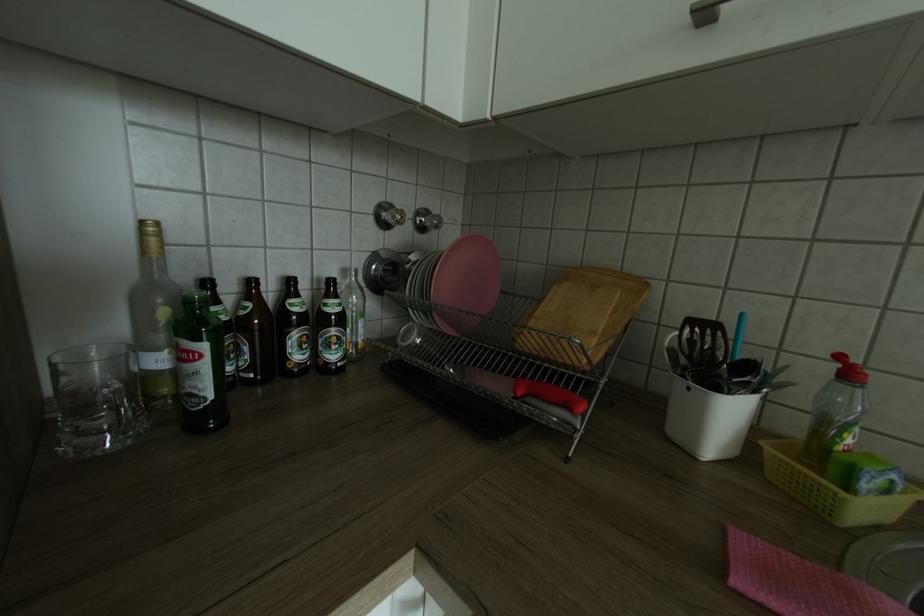
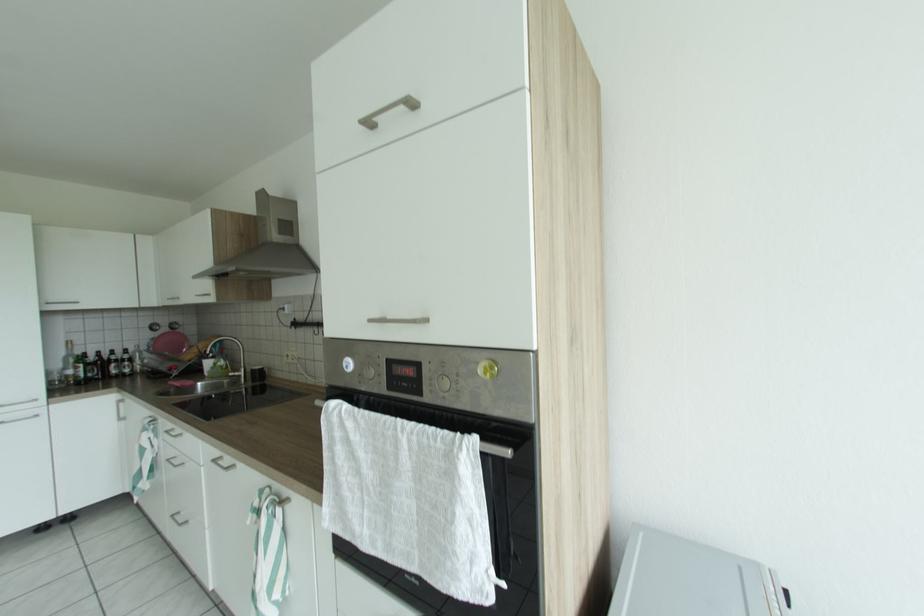
The images are taken continuously from a first-person perspective. In which direction are you moving?

The movement direction of the cameraman is right, backward.